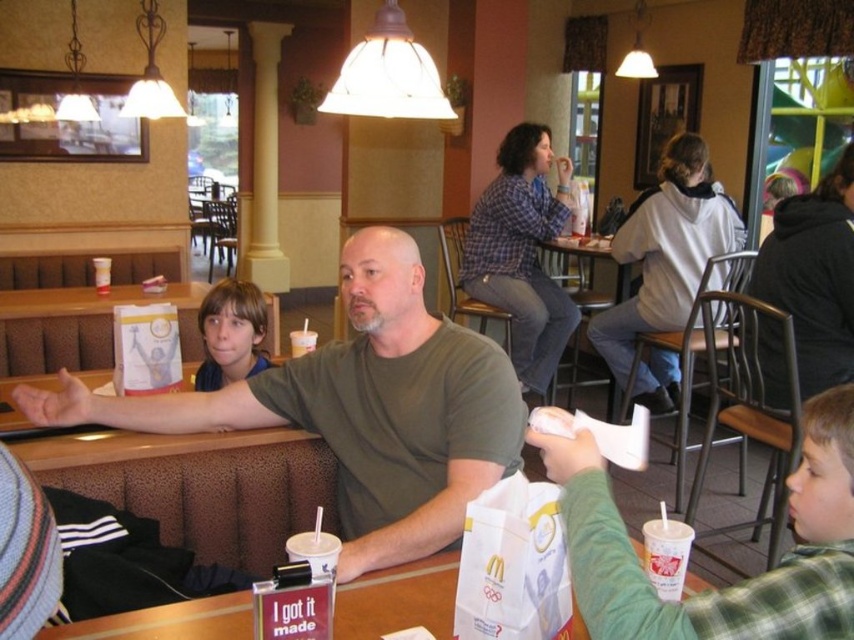
Does white paper bag at center come behind light brown hair at center?

No, it is not.

The height and width of the screenshot is (640, 854). Identify the location of white paper bag at center. (398, 600).

Can you confirm if green plaid shirt at lower right is positioned above wooden table at center?

Incorrect, green plaid shirt at lower right is not positioned above wooden table at center.

Which is more to the left, green plaid shirt at lower right or wooden table at center?

Positioned to the left is green plaid shirt at lower right.

At what (x,y) coordinates should I click in order to perform the action: click on green plaid shirt at lower right. Please return your answer as a coordinate pair (x, y). The image size is (854, 640). Looking at the image, I should click on (730, 586).

From the picture: Does matte green shirt at center have a greater height compared to light brown hair at center?

Yes, matte green shirt at center is taller than light brown hair at center.

This screenshot has height=640, width=854. Describe the element at coordinates (360, 408) in the screenshot. I see `matte green shirt at center` at that location.

Find the location of a particular element. The image size is (854, 640). matte green shirt at center is located at coordinates (360, 408).